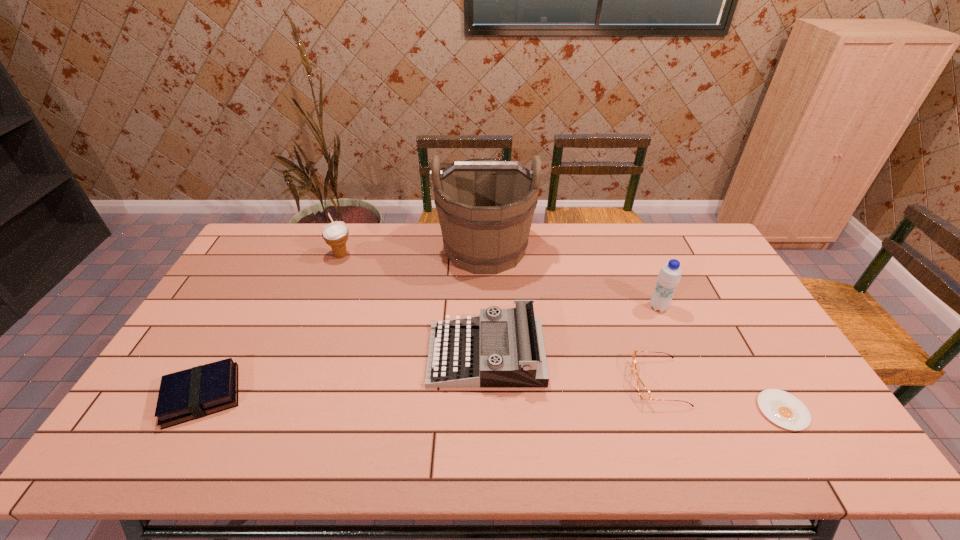
This screenshot has width=960, height=540. I want to click on blank space at the left edge, so click(223, 317).

Identify the location of free space at the far left corner of the desktop. (240, 260).

At what (x,y) coordinates should I click in order to perform the action: click on vacant space at the far right corner. Please return your answer as a coordinate pair (x, y). This screenshot has width=960, height=540. Looking at the image, I should click on (663, 234).

The image size is (960, 540). I want to click on vacant area that lies between the fourth tallest object and the book, so click(x=344, y=375).

Find the location of a particular element. The image size is (960, 540). free space between the rightmost object and the tallest object is located at coordinates (634, 330).

Locate an element on the screen. The width and height of the screenshot is (960, 540). free spot between the fourth tallest object and the rightmost object is located at coordinates (635, 382).

At what (x,y) coordinates should I click in order to perform the action: click on free spot between the leftmost object and the spectacles. Please return your answer as a coordinate pair (x, y). Image resolution: width=960 pixels, height=540 pixels. Looking at the image, I should click on (430, 389).

Image resolution: width=960 pixels, height=540 pixels. I want to click on free area in between the leftmost object and the fourth shortest object, so click(344, 375).

Locate an element on the screen. The image size is (960, 540). free space that is in between the water bottle and the icecream is located at coordinates (499, 281).

The image size is (960, 540). I want to click on vacant point located between the leftmost object and the shortest object, so click(x=492, y=403).